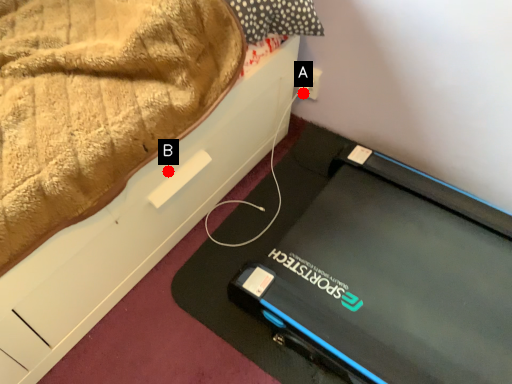
Question: Two points are circled on the image, labeled by A and B beside each circle. Among these points, which one is farthest from the camera?

Choices:
 (A) A is further
 (B) B is further

Answer: (A)